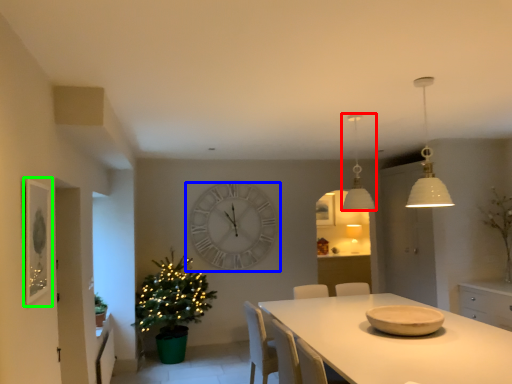
Question: Which is nearer to the lamp (highlighted by a red box)? wall clock (highlighted by a blue box) or picture frame (highlighted by a green box).

Choices:
 (A) wall clock
 (B) picture frame

Answer: (A)